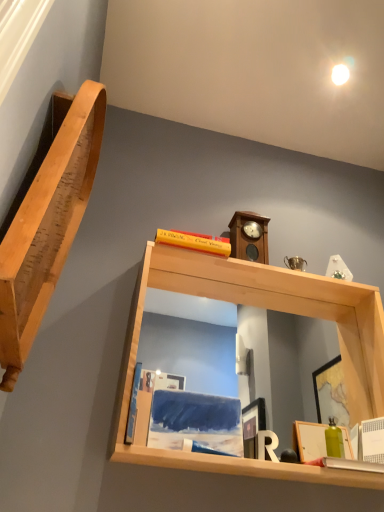
Question: Is matte wooden picture frame at lower right wider than blue matte book at lower left?

Choices:
 (A) no
 (B) yes

Answer: (B)

Question: From a real-world perspective, is matte wooden picture frame at lower right located higher than blue matte book at lower left?

Choices:
 (A) no
 (B) yes

Answer: (A)

Question: Does matte wooden picture frame at lower right have a smaller size compared to blue matte book at lower left?

Choices:
 (A) no
 (B) yes

Answer: (A)

Question: Can blue matte book at lower left be found inside matte wooden picture frame at lower right?

Choices:
 (A) yes
 (B) no

Answer: (B)

Question: Considering the relative sizes of matte wooden picture frame at lower right and blue matte book at lower left in the image provided, is matte wooden picture frame at lower right shorter than blue matte book at lower left?

Choices:
 (A) no
 (B) yes

Answer: (B)

Question: In the image, is natural wood shelf at left, arranged as the 1th shelf when viewed from the left, positioned in front of or behind blue matte book at lower left?

Choices:
 (A) behind
 (B) front

Answer: (B)

Question: Looking at their shapes, would you say natural wood shelf at left, placed as the 2th shelf when sorted from right to left, is wider or thinner than blue matte book at lower left?

Choices:
 (A) wide
 (B) thin

Answer: (A)

Question: Based on their positions, is natural wood shelf at left, placed as the 2th shelf when sorted from right to left, located to the left or right of blue matte book at lower left?

Choices:
 (A) left
 (B) right

Answer: (A)

Question: Is natural wood shelf at left, arranged as the 1th shelf when viewed from the left, taller or shorter than blue matte book at lower left?

Choices:
 (A) short
 (B) tall

Answer: (B)

Question: Considering the positions of light wood/matte mirror at upper center, the second shelf from the left, and wooden clock at upper center in the image, is light wood/matte mirror at upper center, the second shelf from the left, taller or shorter than wooden clock at upper center?

Choices:
 (A) tall
 (B) short

Answer: (A)

Question: Based on their sizes in the image, would you say light wood/matte mirror at upper center, arranged as the first shelf when viewed from the right, is bigger or smaller than wooden clock at upper center?

Choices:
 (A) big
 (B) small

Answer: (A)

Question: Is point (337, 312) closer or farther from the camera than point (240, 214)?

Choices:
 (A) farther
 (B) closer

Answer: (A)

Question: From a real-world perspective, is light wood/matte mirror at upper center, the second shelf from the left, above or below wooden clock at upper center?

Choices:
 (A) above
 (B) below

Answer: (B)

Question: From the image's perspective, relative to light wood/matte mirror at upper center, the second shelf from the left, is blue matte book at lower left above or below?

Choices:
 (A) below
 (B) above

Answer: (A)

Question: From a real-world perspective, is blue matte book at lower left positioned above or below light wood/matte mirror at upper center, arranged as the first shelf when viewed from the right?

Choices:
 (A) below
 (B) above

Answer: (A)